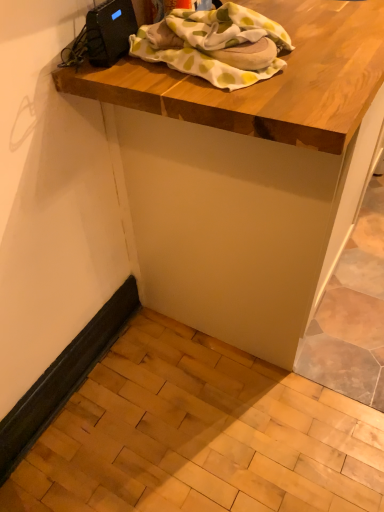
Identify the location of free point to the right of white cotton blanket at upper center. Image resolution: width=384 pixels, height=512 pixels. (340, 37).